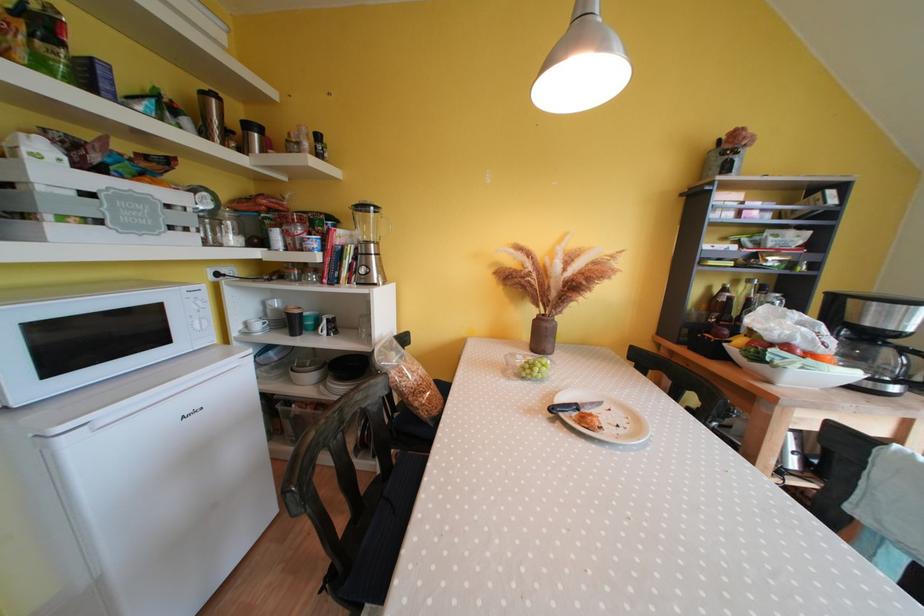
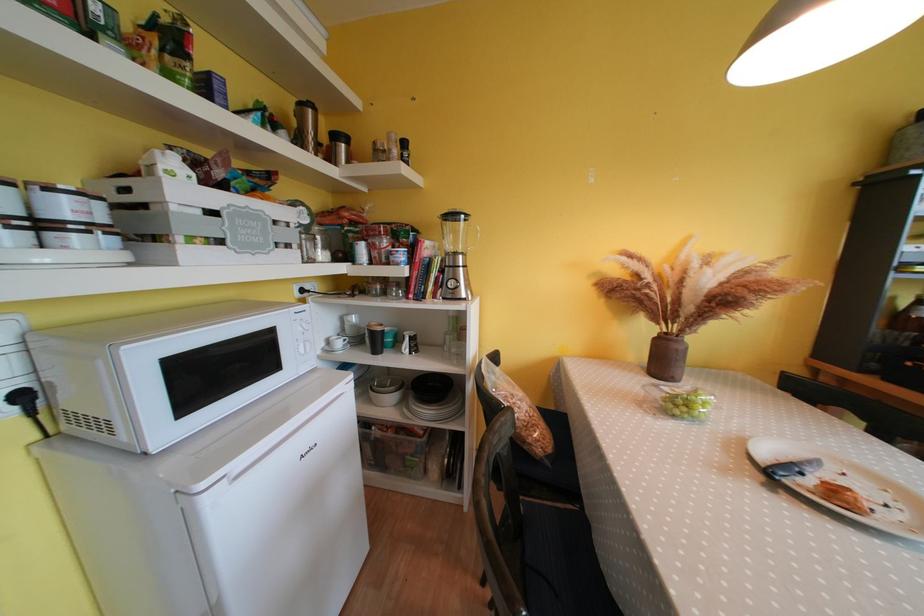
The point at (209, 98) is marked in the first image. Where is the corresponding point in the second image?

(308, 108)